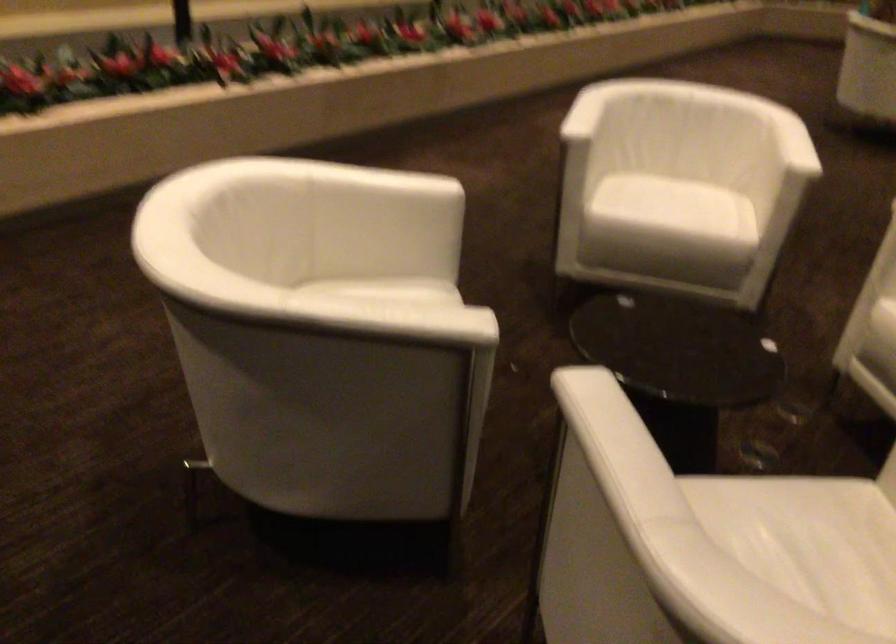
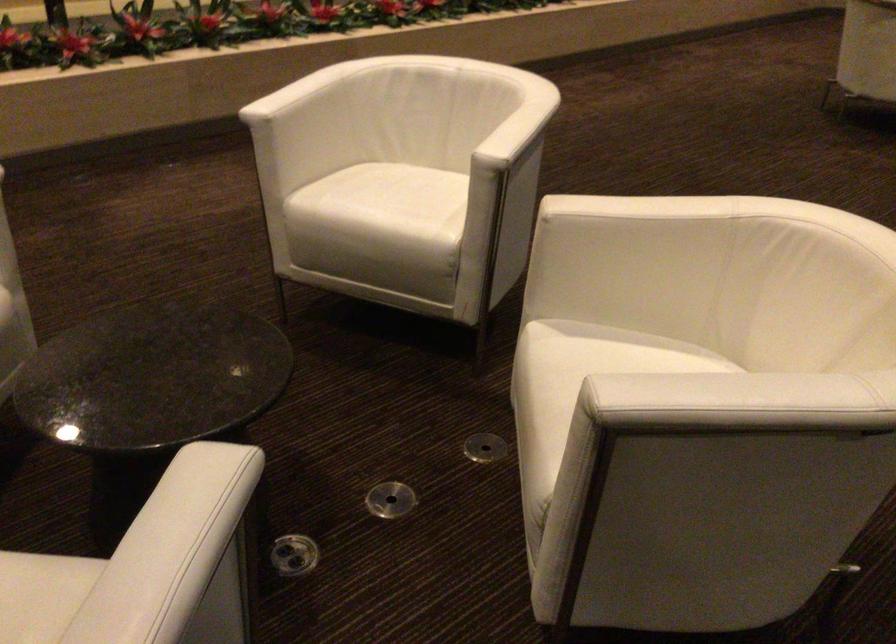
Where in the second image is the point corresponding to the point at 800,129 from the first image?

(515, 122)